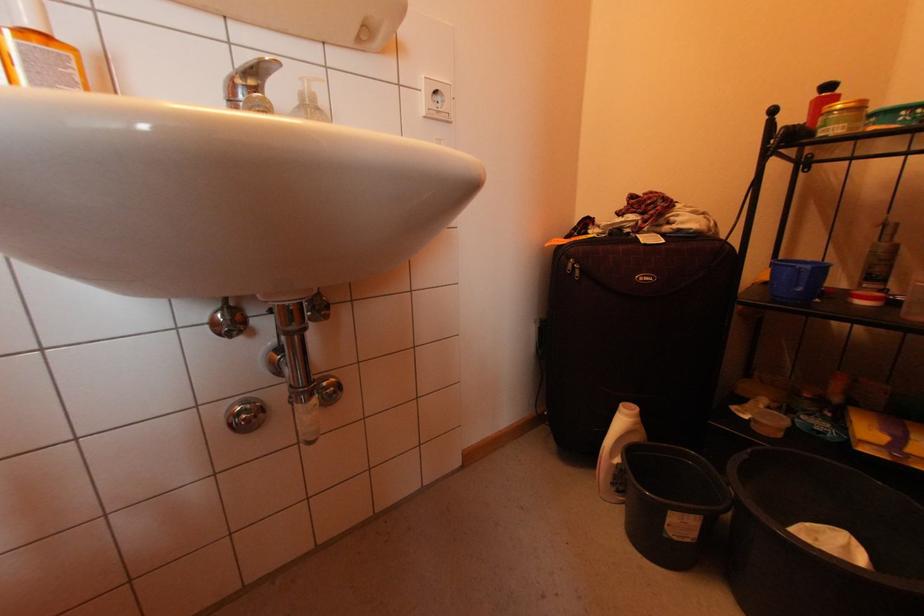
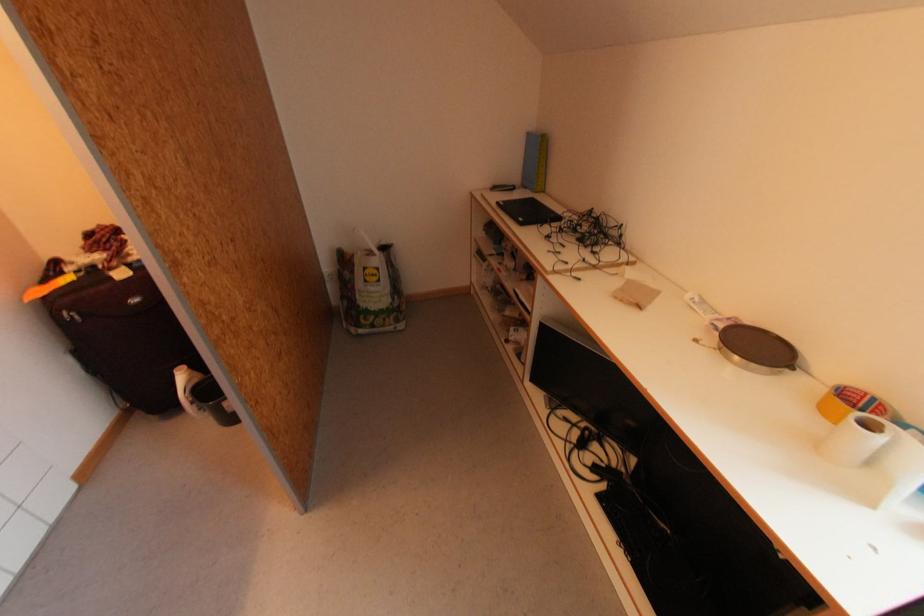
Where in the second image is the point corresponding to (625,230) from the first image?

(98, 267)